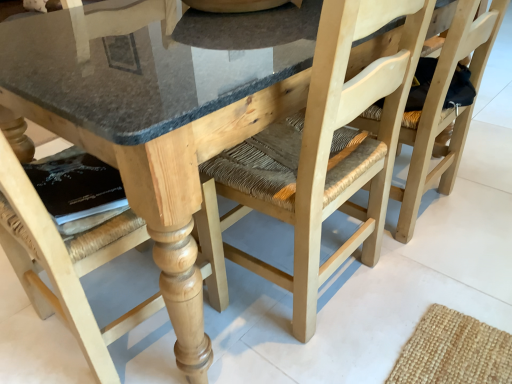
Question: Which direction should I rotate to look at natural wood chair at center, the second chair positioned from the left, — up or down?

Choices:
 (A) down
 (B) up

Answer: (B)

Question: From the image's perspective, is natural wood chair at center, the second chair positioned from the left, above natural wood chair at center, positioned as the third chair in left-to-right order?

Choices:
 (A) yes
 (B) no

Answer: (B)

Question: Is natural wood chair at center, the first chair positioned from the right, inside natural wood chair at center, the second chair positioned from the left?

Choices:
 (A) yes
 (B) no

Answer: (B)

Question: Is natural wood chair at center, acting as the 2th chair starting from the right, positioned beyond the bounds of natural wood chair at center, positioned as the third chair in left-to-right order?

Choices:
 (A) no
 (B) yes

Answer: (B)

Question: Can you confirm if natural wood chair at center, acting as the 2th chair starting from the right, is positioned to the left of natural wood chair at center, positioned as the third chair in left-to-right order?

Choices:
 (A) yes
 (B) no

Answer: (A)

Question: Is natural wood chair at center, acting as the 2th chair starting from the right, far away from natural wood chair at center, the first chair positioned from the right?

Choices:
 (A) no
 (B) yes

Answer: (A)

Question: Is natural wood chair at center, the second chair positioned from the left, thinner than natural wood chair at center, positioned as the third chair in left-to-right order?

Choices:
 (A) no
 (B) yes

Answer: (A)

Question: From the image's perspective, is natural wood chair at lower left, the 3th chair in the right-to-left sequence, below natural wood chair at center, acting as the 2th chair starting from the right?

Choices:
 (A) yes
 (B) no

Answer: (A)

Question: From a real-world perspective, is natural wood chair at lower left, placed as the first chair when sorted from left to right, over natural wood chair at center, acting as the 2th chair starting from the right?

Choices:
 (A) yes
 (B) no

Answer: (A)

Question: Can you confirm if natural wood chair at lower left, placed as the first chair when sorted from left to right, is positioned to the left of natural wood chair at center, acting as the 2th chair starting from the right?

Choices:
 (A) yes
 (B) no

Answer: (A)

Question: Is natural wood chair at center, acting as the 2th chair starting from the right, located within natural wood chair at lower left, placed as the first chair when sorted from left to right?

Choices:
 (A) yes
 (B) no

Answer: (B)

Question: Does natural wood chair at lower left, the 3th chair in the right-to-left sequence, have a lesser height compared to natural wood chair at center, the second chair positioned from the left?

Choices:
 (A) no
 (B) yes

Answer: (A)

Question: Considering the relative positions of natural wood chair at lower left, the 3th chair in the right-to-left sequence, and natural wood chair at center, acting as the 2th chair starting from the right, in the image provided, is natural wood chair at lower left, the 3th chair in the right-to-left sequence, in front of natural wood chair at center, acting as the 2th chair starting from the right,?

Choices:
 (A) no
 (B) yes

Answer: (B)

Question: Are natural wood chair at lower left, placed as the first chair when sorted from left to right, and natural wood chair at center, the first chair positioned from the right, far apart?

Choices:
 (A) no
 (B) yes

Answer: (A)